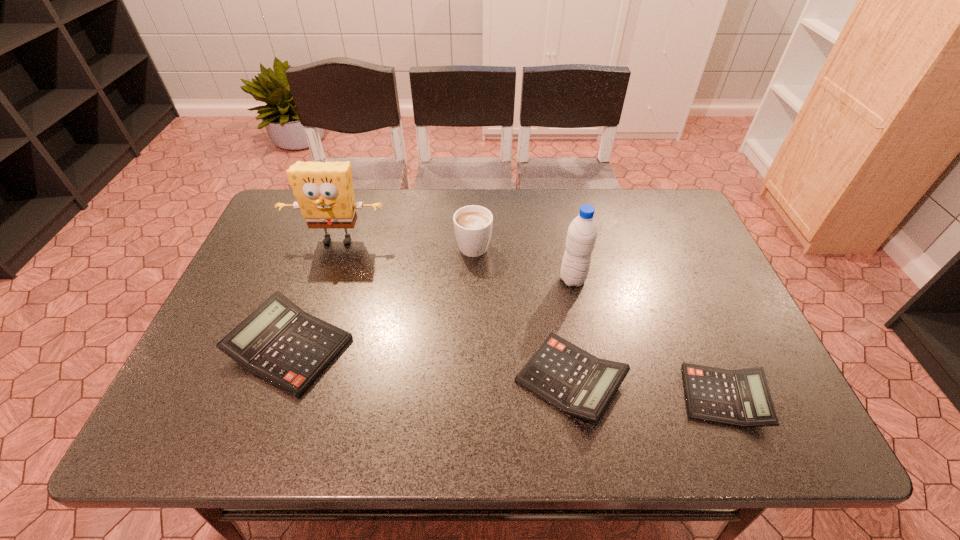
The height and width of the screenshot is (540, 960). I want to click on the leftmost calculator, so click(x=280, y=343).

This screenshot has width=960, height=540. Find the location of `the second shortest calculator`. the second shortest calculator is located at coordinates (569, 378).

Where is `the second calculator from left to right`? the second calculator from left to right is located at coordinates (569, 378).

Identify the location of the rightmost object. (741, 398).

Where is `the shortest object`? the shortest object is located at coordinates (741, 398).

You are a GUI agent. You are given a task and a screenshot of the screen. Output one action in this format:
    pyautogui.click(x=<x>, y=<y>)
    Task: Click on the sponge
    
    Given the screenshot: What is the action you would take?
    pyautogui.click(x=324, y=191)

You are a GUI agent. You are given a task and a screenshot of the screen. Output one action in this format:
    pyautogui.click(x=<x>, y=<y>)
    Task: Click on the third tallest object
    The height and width of the screenshot is (540, 960).
    Given the screenshot: What is the action you would take?
    pyautogui.click(x=473, y=224)

Identify the location of cappuccino. The height and width of the screenshot is (540, 960). (473, 224).

You are a GUI agent. You are given a task and a screenshot of the screen. Output one action in this format:
    pyautogui.click(x=<x>, y=<y>)
    Task: Click on the water bottle
    This screenshot has height=540, width=960.
    Given the screenshot: What is the action you would take?
    pyautogui.click(x=582, y=233)

At what (x,y) coordinates should I click in order to perform the action: click on free space located 0.190m on the right of the leftmost calculator. Please return your answer as a coordinate pair (x, y). The height and width of the screenshot is (540, 960). Looking at the image, I should click on (431, 348).